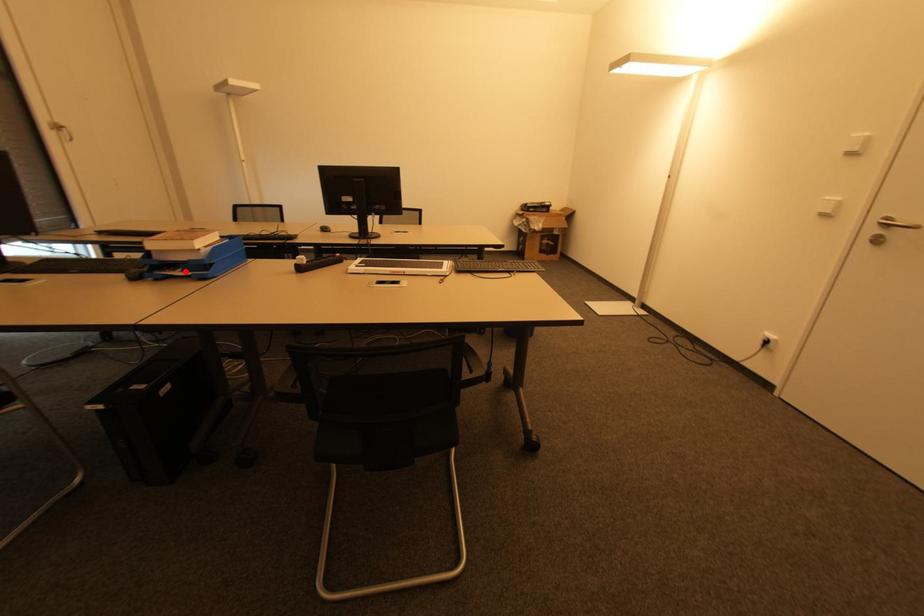
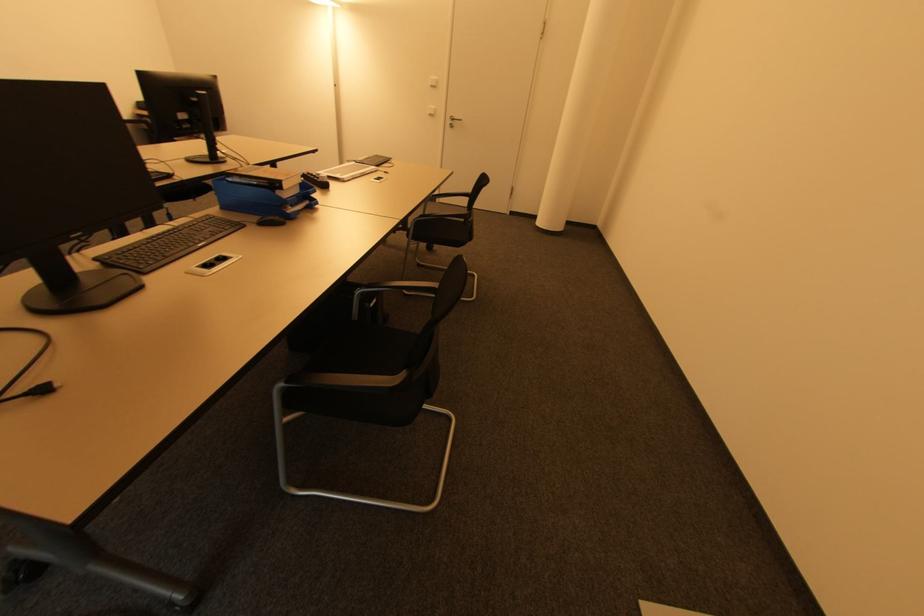
Question: A red point is marked in image1. In image2, is the corresponding 3D point closer to the camera or farther? Reply with the corresponding letter.

Choices:
 (A) The corresponding 3D point is closer.
 (B) The corresponding 3D point is farther.

Answer: (A)